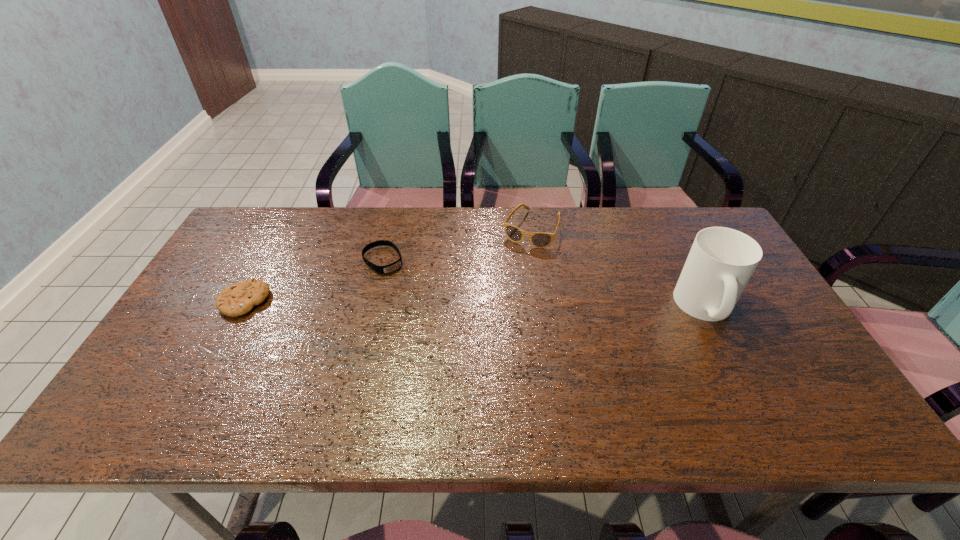
The height and width of the screenshot is (540, 960). Identify the location of cookie. (237, 299).

Find the location of a particular element. mug is located at coordinates (721, 261).

The width and height of the screenshot is (960, 540). I want to click on the rightmost object, so click(721, 261).

You are a GUI agent. You are given a task and a screenshot of the screen. Output one action in this format:
    pyautogui.click(x=<x>, y=<y>)
    Task: Click on the shortest object
    
    Given the screenshot: What is the action you would take?
    pyautogui.click(x=389, y=268)

Where is `wristband`? The width and height of the screenshot is (960, 540). wristband is located at coordinates (389, 268).

Image resolution: width=960 pixels, height=540 pixels. Identify the location of sunglasses. (538, 239).

Where is `the second object from right to left`? This screenshot has width=960, height=540. the second object from right to left is located at coordinates (538, 239).

In order to click on vacant point located 0.060m on the front of the cookie in this screenshot , I will do `click(225, 338)`.

Image resolution: width=960 pixels, height=540 pixels. What are the coordinates of `free region located on the handle side of the rightmost object` in the screenshot? It's located at (739, 374).

Locate an element on the screen. The width and height of the screenshot is (960, 540). vacant region located 0.400m on the display of the wristband is located at coordinates (473, 360).